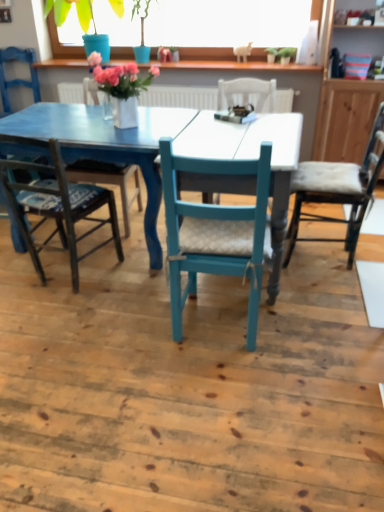
Question: Is the position of matte blue chair at left, which is the sixth chair from right to left, less distant than that of matte blue chair at center, the 4th chair when ordered from right to left?

Choices:
 (A) no
 (B) yes

Answer: (A)

Question: Is matte blue chair at center, the 4th chair when ordered from right to left, located within matte blue chair at left, which is the sixth chair from right to left?

Choices:
 (A) yes
 (B) no

Answer: (B)

Question: Can you confirm if matte blue chair at left, the first chair when ordered from left to right, is bigger than matte blue chair at center, the 4th chair when ordered from right to left?

Choices:
 (A) no
 (B) yes

Answer: (A)

Question: From a real-world perspective, is matte blue chair at left, which is the sixth chair from right to left, located beneath matte blue chair at center, the 4th chair when ordered from right to left?

Choices:
 (A) no
 (B) yes

Answer: (A)

Question: Is matte blue chair at left, which is the sixth chair from right to left, wider than matte blue chair at center, positioned as the 3th chair in left-to-right order?

Choices:
 (A) yes
 (B) no

Answer: (B)

Question: Is matte blue chair at left, which is the sixth chair from right to left, to the right of matte blue chair at center, positioned as the 3th chair in left-to-right order, from the viewer's perspective?

Choices:
 (A) no
 (B) yes

Answer: (A)

Question: Can you see teal wood chair at center, which appears as the 2th chair when viewed from the right, touching matte blue chair at center, positioned as the 4th chair in left-to-right order?

Choices:
 (A) yes
 (B) no

Answer: (B)

Question: Considering the relative positions of teal wood chair at center, which appears as the 2th chair when viewed from the right, and matte blue chair at center, which ranks as the 3th chair in right-to-left order, in the image provided, is teal wood chair at center, which appears as the 2th chair when viewed from the right, to the right of matte blue chair at center, which ranks as the 3th chair in right-to-left order, from the viewer's perspective?

Choices:
 (A) yes
 (B) no

Answer: (A)

Question: Can you confirm if teal wood chair at center, placed as the fifth chair when sorted from left to right, is shorter than matte blue chair at center, positioned as the 4th chair in left-to-right order?

Choices:
 (A) no
 (B) yes

Answer: (A)

Question: Is teal wood chair at center, placed as the fifth chair when sorted from left to right, oriented towards matte blue chair at center, which ranks as the 3th chair in right-to-left order?

Choices:
 (A) yes
 (B) no

Answer: (B)

Question: Can you confirm if teal wood chair at center, which appears as the 2th chair when viewed from the right, is bigger than matte blue chair at center, positioned as the 4th chair in left-to-right order?

Choices:
 (A) no
 (B) yes

Answer: (A)

Question: Is teal wood chair at center, placed as the fifth chair when sorted from left to right, thinner than matte blue chair at center, positioned as the 4th chair in left-to-right order?

Choices:
 (A) no
 (B) yes

Answer: (B)

Question: Is white cushioned chair at right, the first chair in the right-to-left sequence, with matte blue chair at center, positioned as the 3th chair in left-to-right order?

Choices:
 (A) no
 (B) yes

Answer: (A)